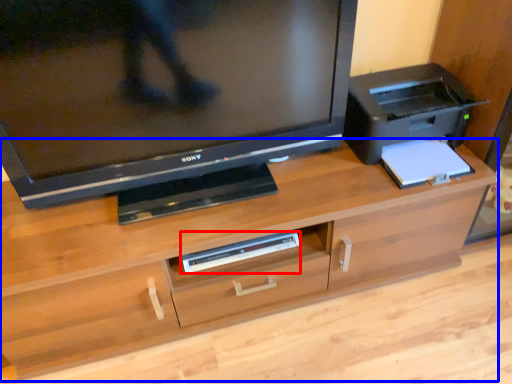
Question: Which of the following is the farthest to the observer, equipment (highlighted by a red box) or desk (highlighted by a blue box)?

Choices:
 (A) equipment
 (B) desk

Answer: (A)